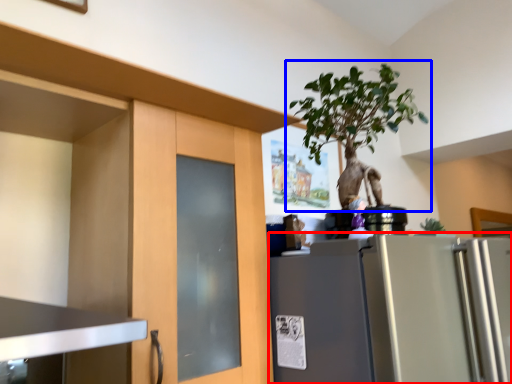
Question: Which object is further to the camera taking this photo, refrigerator (highlighted by a red box) or houseplant (highlighted by a blue box)?

Choices:
 (A) refrigerator
 (B) houseplant

Answer: (B)